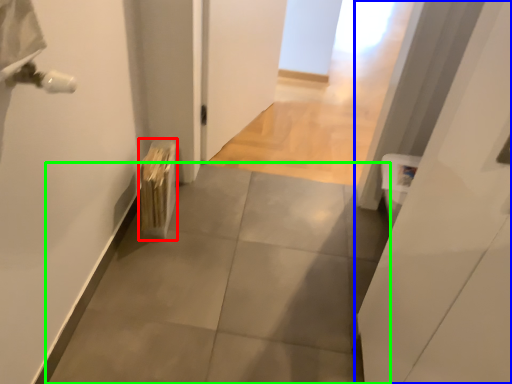
Question: Which object is the farthest from radiator (highlighted by a red box)? Choose among these: door (highlighted by a blue box) or concrete (highlighted by a green box).

Choices:
 (A) door
 (B) concrete

Answer: (A)